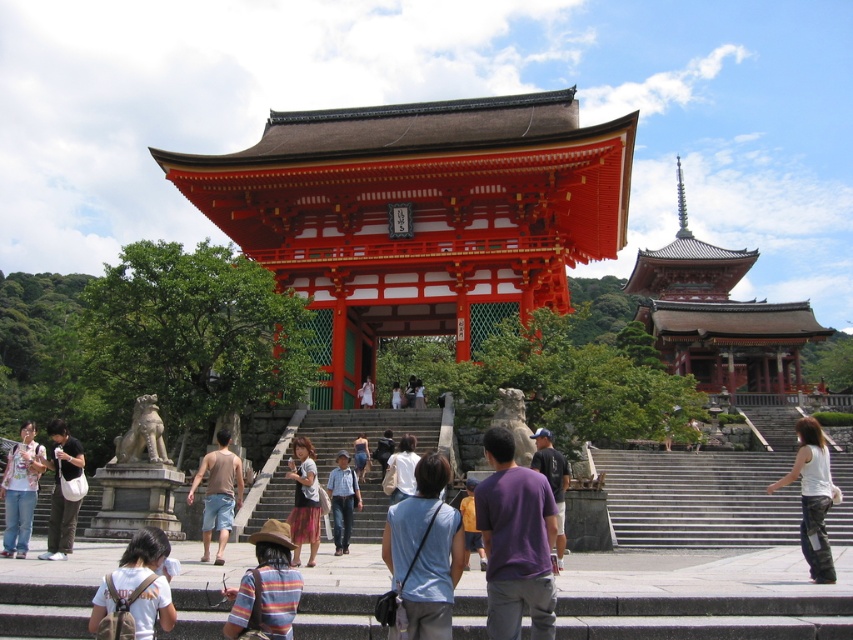
You are a photographer standing at the bottom of the stone steps leading to the temple. You want to take a picture of both the purple cotton shirt at center and the dark blue shirt at center. Which person should you focus on first to ensure both are in the frame?

You should focus on the purple cotton shirt at center first because it is in front of the dark blue shirt at center, ensuring both will be captured in the frame.